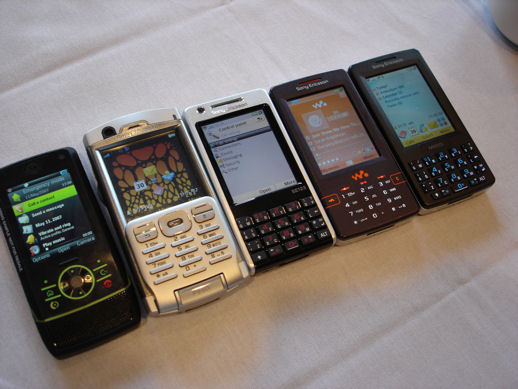
The height and width of the screenshot is (389, 518). Find the location of `cloth on table`. cloth on table is located at coordinates (338, 327).